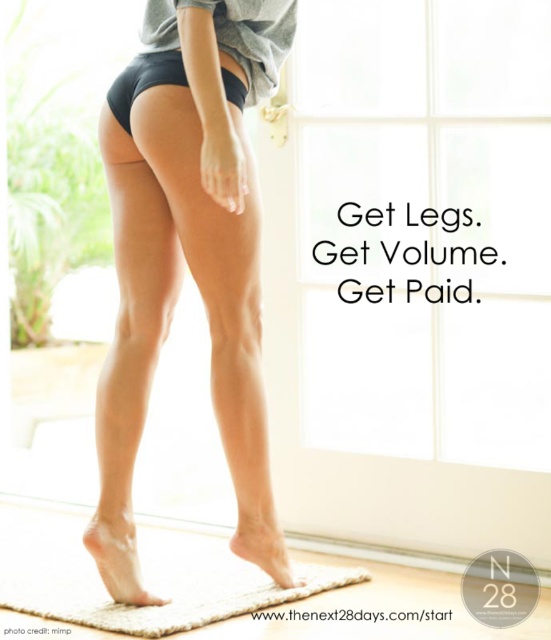
Question: Is black matte shorts at center positioned in front of matte black underwear at center?

Choices:
 (A) yes
 (B) no

Answer: (A)

Question: Which point is farther to the camera?

Choices:
 (A) (121, 76)
 (B) (88, 614)
 (C) (118, 438)

Answer: (C)

Question: Does beige textured yoga mat at lower center appear under black matte shorts at center?

Choices:
 (A) no
 (B) yes

Answer: (B)

Question: Does beige textured yoga mat at lower center appear on the right side of matte black underwear at center?

Choices:
 (A) no
 (B) yes

Answer: (A)

Question: Considering the real-world distances, which object is closest to the black matte shorts at center?

Choices:
 (A) beige textured yoga mat at lower center
 (B) smooth matte black shorts at center

Answer: (B)

Question: Based on their relative distances, which object is nearer to the smooth matte black shorts at center?

Choices:
 (A) black matte shorts at center
 (B) matte black underwear at center
 (C) beige textured yoga mat at lower center

Answer: (A)